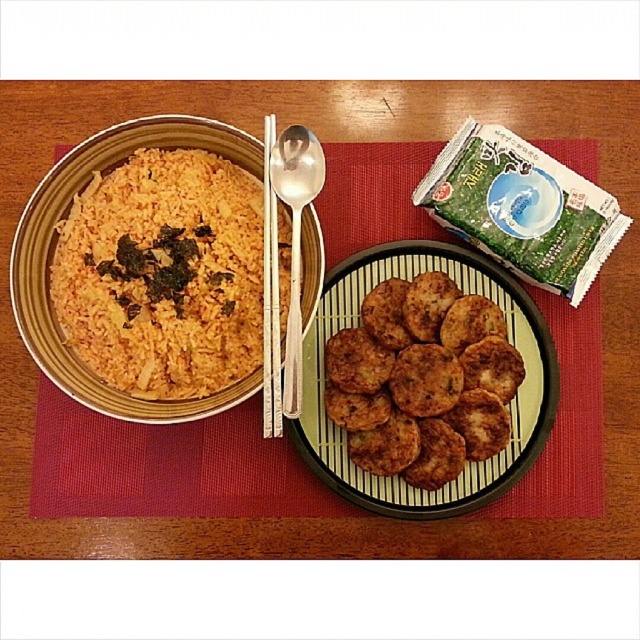
Question: Can you confirm if yellow matte rice at left is positioned below white wood chopsticks at upper center?

Choices:
 (A) yes
 (B) no

Answer: (A)

Question: Among these points, which one is nearest to the camera?

Choices:
 (A) (486, 221)
 (B) (458, 301)

Answer: (A)

Question: Does brown crispy patties at center have a lesser width compared to silver metallic spoon at center?

Choices:
 (A) no
 (B) yes

Answer: (A)

Question: Among these objects, which one is farthest from the camera?

Choices:
 (A) green matte seaweed packet at upper right
 (B) white wood chopsticks at upper center

Answer: (A)

Question: Which point is closer to the camera?

Choices:
 (A) (268, 193)
 (B) (413, 483)

Answer: (A)

Question: Is yellow matte rice at left wider than green matte seaweed packet at upper right?

Choices:
 (A) yes
 (B) no

Answer: (A)